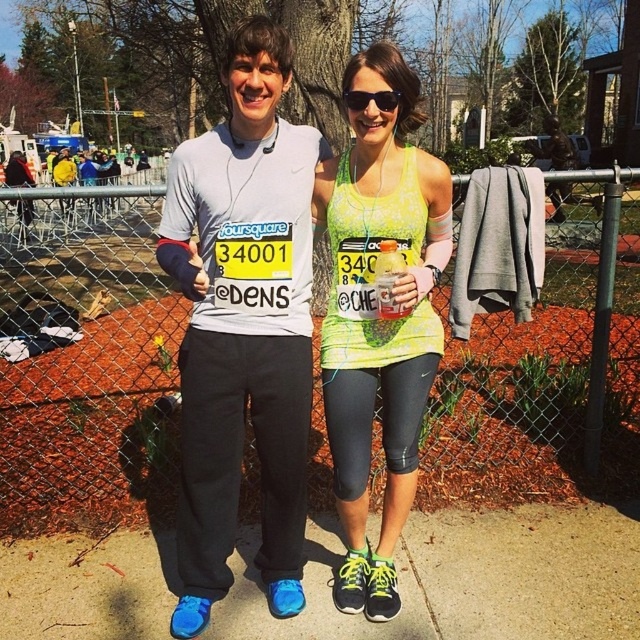
Question: Can you confirm if metal chain-link fence at center is wider than smooth concrete pavement at center?

Choices:
 (A) no
 (B) yes

Answer: (B)

Question: Which object appears closest to the camera in this image?

Choices:
 (A) black plastic sunglasses at center
 (B) metal chain-link fence at center
 (C) neon yellow tank top at center
 (D) smooth concrete pavement at center

Answer: (C)

Question: Is smooth concrete pavement at center to the left of black plastic sunglasses at center from the viewer's perspective?

Choices:
 (A) yes
 (B) no

Answer: (A)

Question: Is metal chain-link fence at center thinner than matte gray shirt at center?

Choices:
 (A) no
 (B) yes

Answer: (A)

Question: Which object is the farthest from the smooth concrete pavement at center?

Choices:
 (A) black plastic sunglasses at center
 (B) neon yellow tank top at center
 (C) matte gray shirt at center
 (D) metal chain-link fence at center

Answer: (D)

Question: Which point is farther to the camera?

Choices:
 (A) smooth concrete pavement at center
 (B) matte gray shirt at center
 (C) black plastic sunglasses at center
 (D) metal chain-link fence at center

Answer: (D)